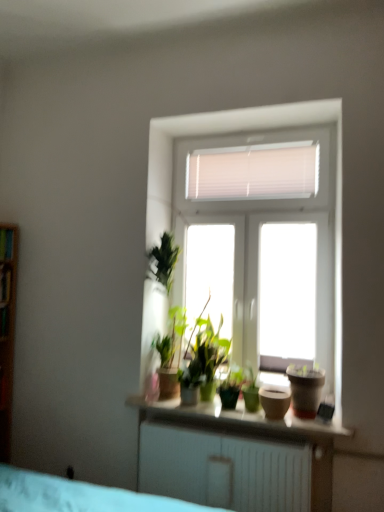
Question: Is point (311, 392) closer or farther from the camera than point (13, 253)?

Choices:
 (A) farther
 (B) closer

Answer: (B)

Question: Considering the positions of matte brown pot at right, positioned as the first flowerpot in right-to-left order, and wooden shelf at left, placed as the first shelf when sorted from top to bottom, in the image, is matte brown pot at right, positioned as the first flowerpot in right-to-left order, wider or thinner than wooden shelf at left, placed as the first shelf when sorted from top to bottom,?

Choices:
 (A) wide
 (B) thin

Answer: (A)

Question: Estimate the real-world distances between objects in this image. Which object is closer to the transparent glass window at upper center?

Choices:
 (A) wooden shelf at left, positioned as the 1th shelf in bottom-to-top order
 (B) smooth white shelf at center
 (C) matte brown pot at right, which is counted as the second flowerpot, starting from the left
 (D) matte brown pot at center, which is counted as the first flowerpot, starting from the left
 (E) wooden shelf at left, placed as the first shelf when sorted from top to bottom

Answer: (A)

Question: Which is nearer to the green matte houseplant at center?

Choices:
 (A) transparent glass window at upper center
 (B) smooth white shelf at center
 (C) matte brown pot at center, arranged as the second flowerpot when viewed from the right
 (D) wooden shelf at left, which is the 2th shelf in top-to-bottom order
 (E) wooden shelf at left, placed as the first shelf when sorted from top to bottom

Answer: (C)